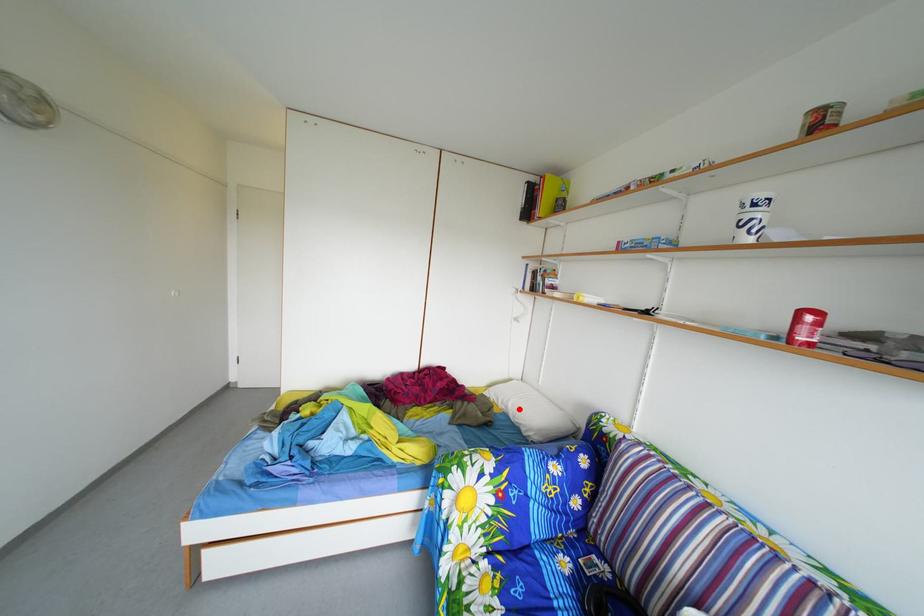
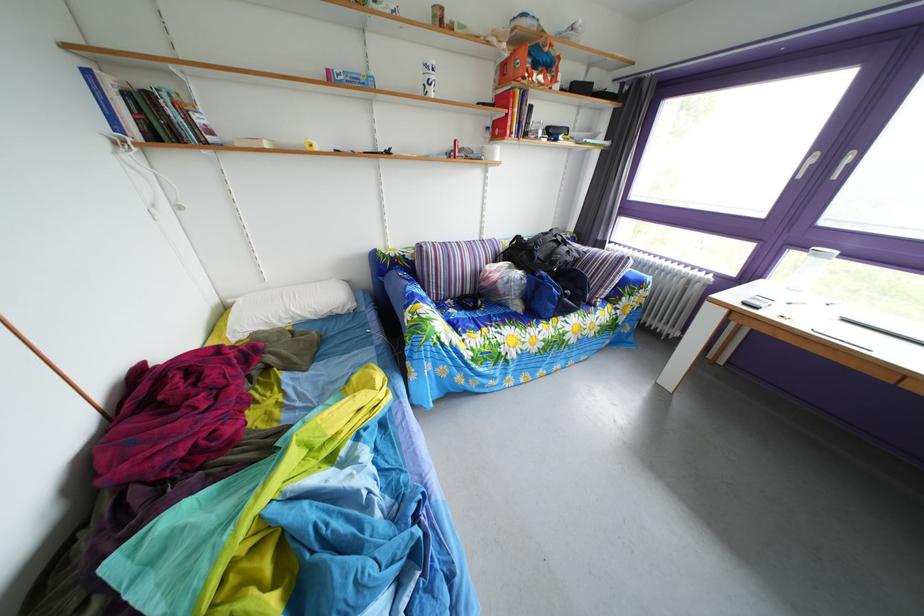
In the second image, find the point that corresponds to the highlighted location in the first image.

(298, 320)